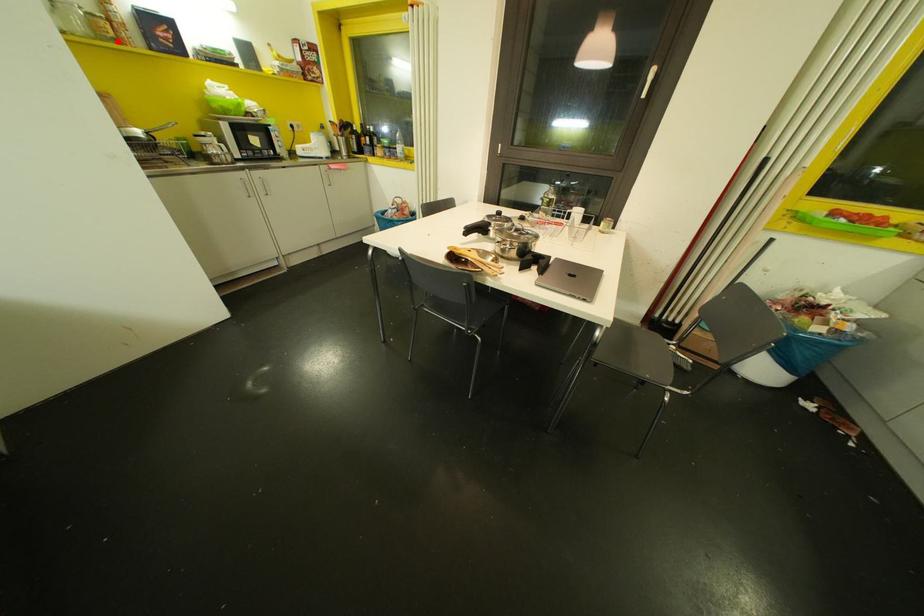
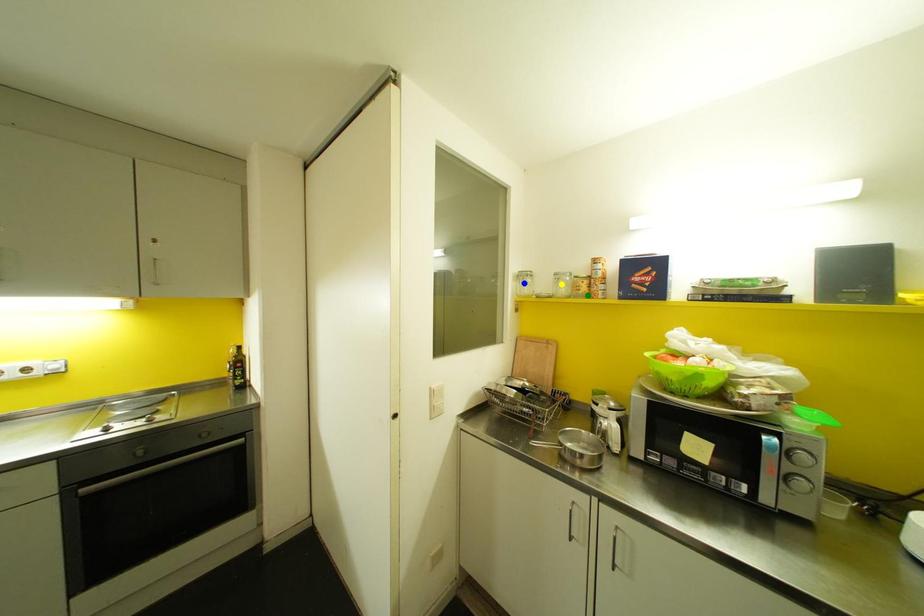
Question: I am providing you with two images of the same scene from different viewpoints. A red point is marked on the first image. You are given multiple points on the second image. Which spot in image 2 lines up with the point in image 1?

Choices:
 (A) yellow point
 (B) green point
 (C) blue point

Answer: (B)